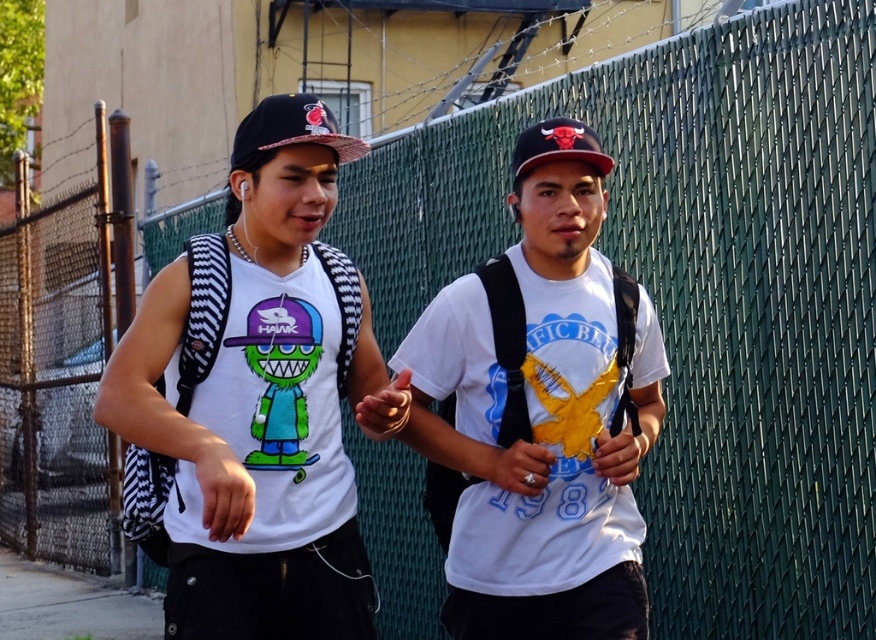
Question: Does gray concrete pavement at lower left have a lesser width compared to red matte baseball cap at center?

Choices:
 (A) yes
 (B) no

Answer: (B)

Question: In this image, where is white matte t-shirt at center located relative to red matte baseball cap at center?

Choices:
 (A) below
 (B) above

Answer: (A)

Question: Does matte black baseball cap at upper center have a smaller size compared to red matte baseball cap at center?

Choices:
 (A) no
 (B) yes

Answer: (B)

Question: Which point appears farthest from the camera in this image?

Choices:
 (A) (46, 625)
 (B) (485, 560)
 (C) (212, 352)
 (D) (533, 464)

Answer: (A)

Question: Estimate the real-world distances between objects in this image. Which object is farther from the gray concrete pavement at lower left?

Choices:
 (A) white matte t-shirt at center
 (B) matte black baseball cap at upper center
 (C) red matte baseball cap at center
 (D) silver metallic ring at center

Answer: (B)

Question: Which point appears closest to the camera in this image?

Choices:
 (A) (583, 296)
 (B) (323, 120)

Answer: (B)